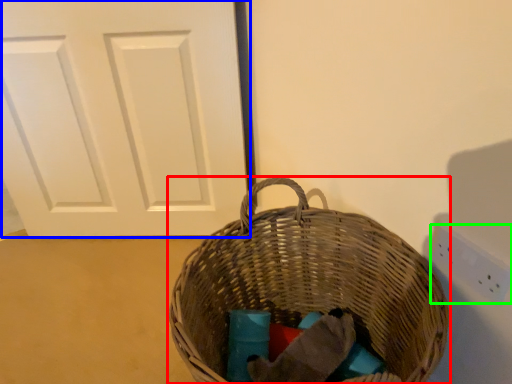
Question: Which object is positioned farthest from picnic basket (highlighted by a red box)? Select from door (highlighted by a blue box) and electric outlet (highlighted by a green box).

Choices:
 (A) door
 (B) electric outlet

Answer: (A)